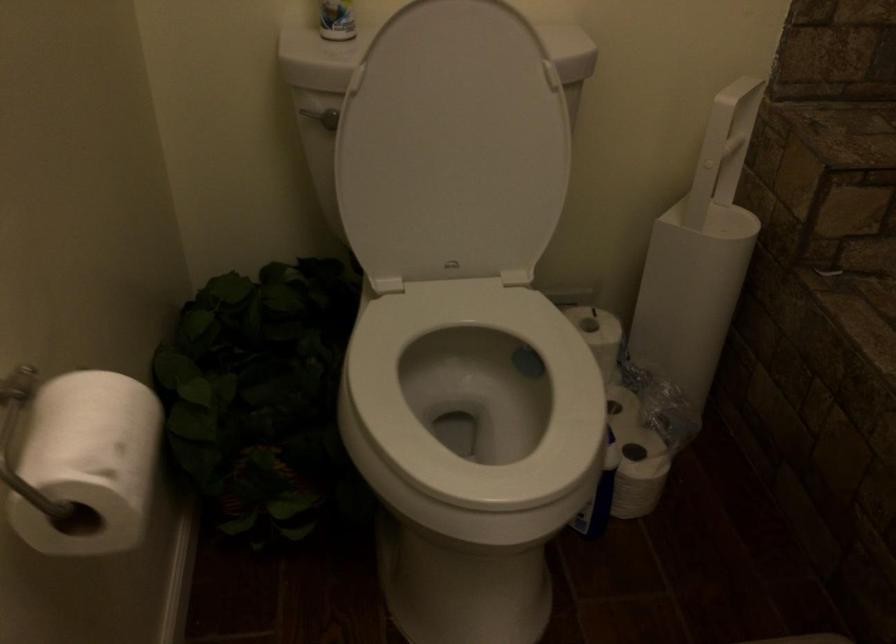
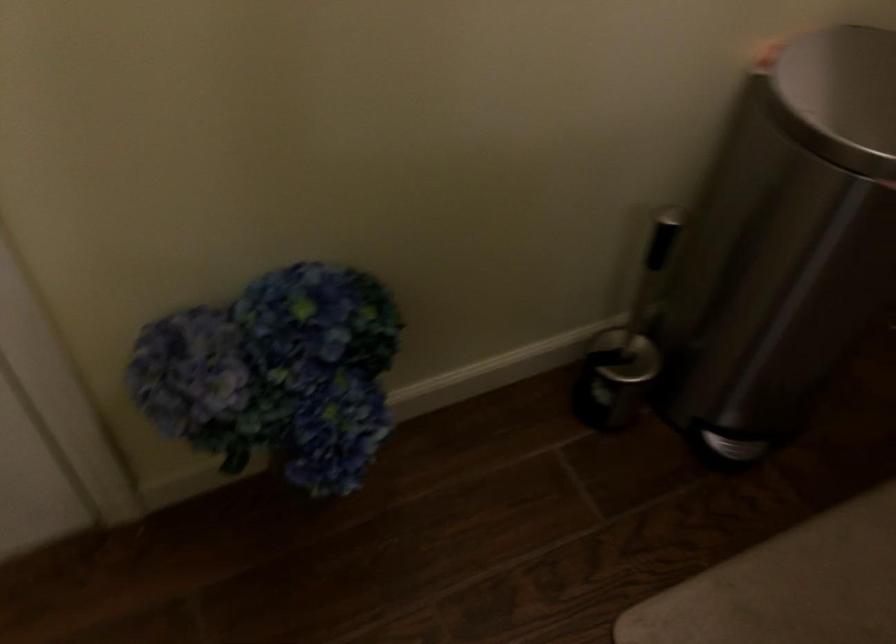
Looking at this image, first-person continuous shooting, in which direction is the camera rotating?

The rotation direction of the camera is left-down.